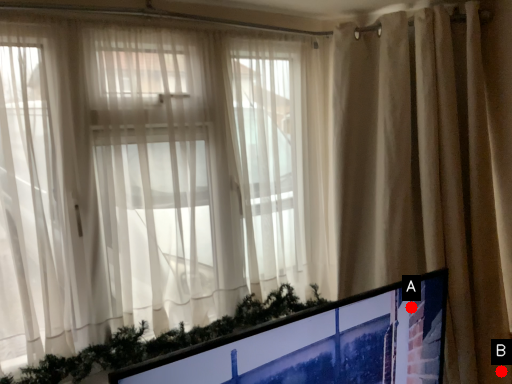
Question: Two points are circled on the image, labeled by A and B beside each circle. Which of the following is the farthest from the observer?

Choices:
 (A) A is further
 (B) B is further

Answer: (B)